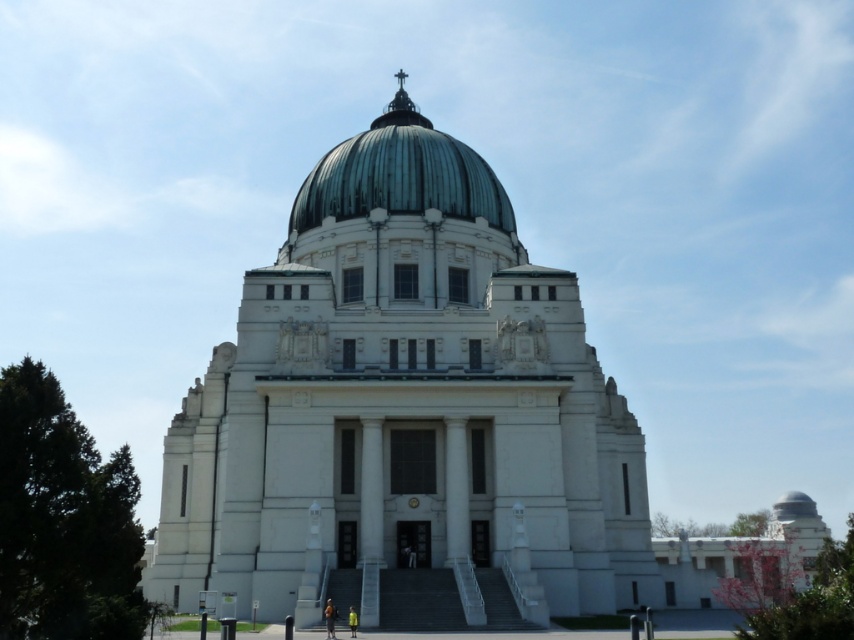
You are a maintenance worker needing to inspect the green copper dome at center of the white stone church at center. The inspection ladder you have can reach up to 40 feet. Can you safely reach the dome from the church base without needing additional equipment?

The white stone church at center and green copper dome at center are 41.61 feet apart from each other. Since the ladder can only reach up to 40 feet, you cannot safely reach the dome without additional equipment.

You are standing in front of the grand architectural structure described. There is a point labeled at coordinates (408, 412). Based on the scene, what does this point most likely represent?

The point at (408, 412) most likely represents the location of the white stone church at center, as it is the central feature of the scene.